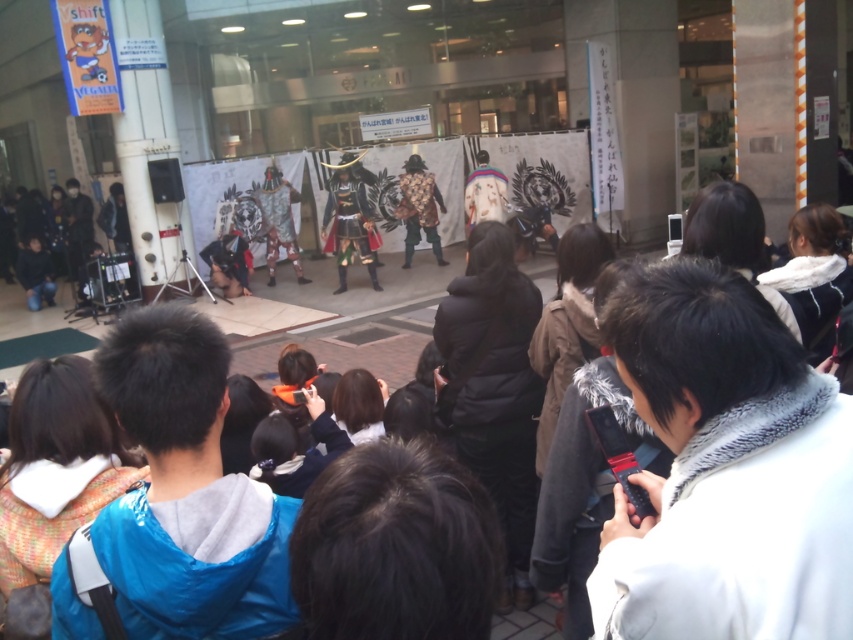
You are a photographer positioned at the back of the crowd. You want to capture a photo of both the shiny metallic armor at center and the leather armor at center without any obstruction. Based on their sizes, which armor should you prioritize framing closer to the edge of the photo to avoid cropping?

The shiny metallic armor at center is wider than the leather armor at center. To avoid cropping, prioritize framing the wider shiny metallic armor at center closer to the edge of the photo so it fits better within the frame.